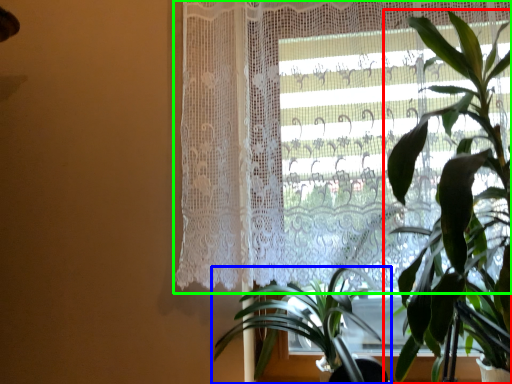
Question: Estimate the real-world distances between objects in this image. Which object is closer to houseplant (highlighted by a red box), houseplant (highlighted by a blue box) or curtain (highlighted by a green box)?

Choices:
 (A) houseplant
 (B) curtain

Answer: (B)